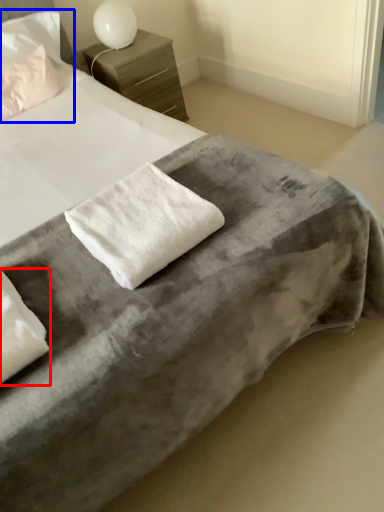
Question: Among these objects, which one is nearest to the camera, pillow (highlighted by a red box) or pillow (highlighted by a blue box)?

Choices:
 (A) pillow
 (B) pillow

Answer: (A)